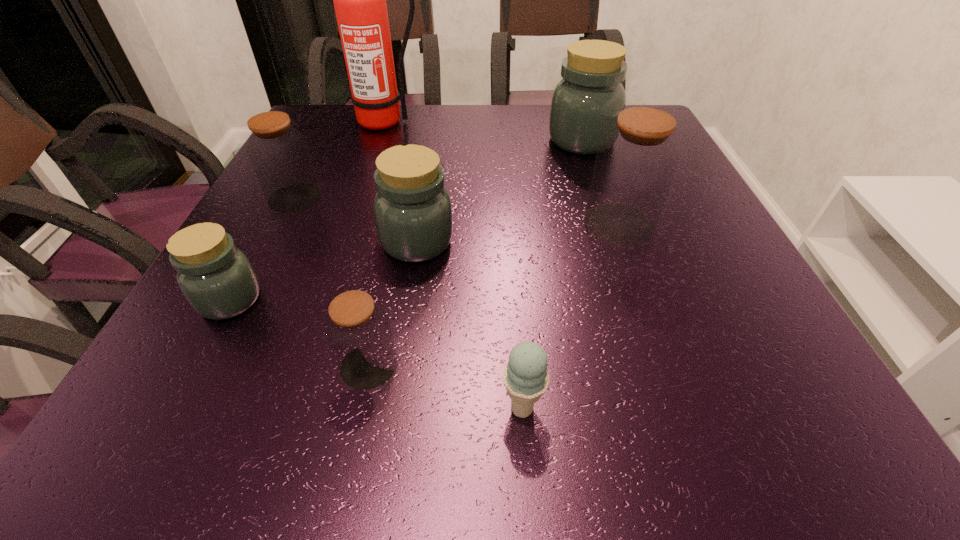
At what (x,y) coordinates should I click in order to perform the action: click on the smallest brown jar. Please return your answer as a coordinate pair (x, y). This screenshot has width=960, height=540. Looking at the image, I should click on pos(358,331).

This screenshot has width=960, height=540. In order to click on the second brown jar from left to right in this screenshot , I will do tap(358, 331).

The height and width of the screenshot is (540, 960). Identify the location of ice cream. (525, 377).

Where is `the third object from right to left`? the third object from right to left is located at coordinates [525, 377].

In order to click on vacant space situated on the handle side of the red fire extinguisher in this screenshot , I will do `click(357, 206)`.

Locate an element on the screen. The image size is (960, 540). vacant space situated 0.110m on the front of the biggest brown jar is located at coordinates pos(641,287).

The image size is (960, 540). I want to click on vacant region located 0.200m on the left of the rightmost green jar, so click(x=471, y=140).

You are a GUI agent. You are given a task and a screenshot of the screen. Output one action in this format:
    pyautogui.click(x=<x>, y=<y>)
    Task: Click on the vacant space located 0.050m on the back of the leftmost brown jar
    This screenshot has height=540, width=960.
    Given the screenshot: What is the action you would take?
    pyautogui.click(x=308, y=172)

At what (x,y) coordinates should I click in order to perform the action: click on vacant space located on the back of the second green jar from left to right. Please return your answer as a coordinate pair (x, y). The image size is (960, 540). Looking at the image, I should click on (429, 161).

Image resolution: width=960 pixels, height=540 pixels. In order to click on vacant space located 0.320m on the back of the third nearest object in this screenshot , I will do `click(295, 179)`.